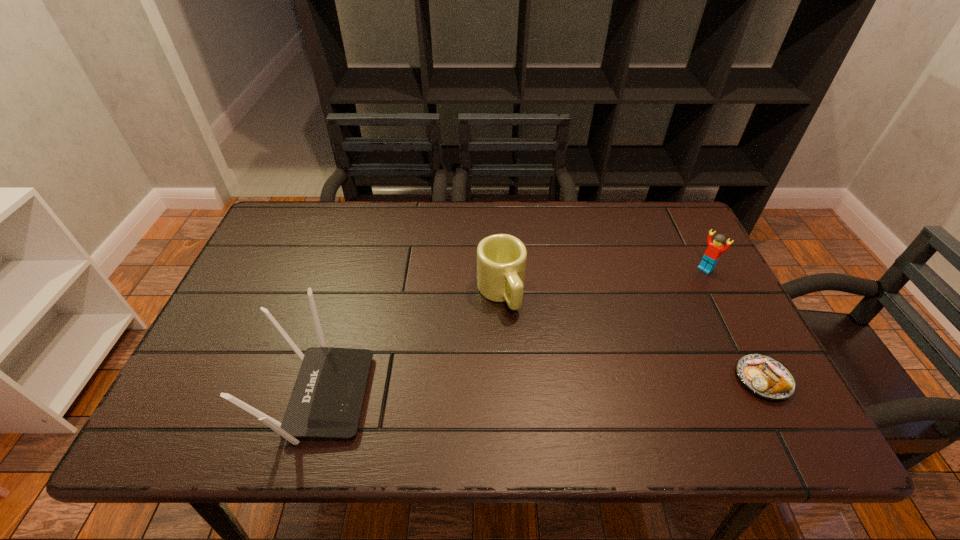
You are a GUI agent. You are given a task and a screenshot of the screen. Output one action in this format:
    pyautogui.click(x=<x>, y=<y>)
    Task: Click on the free space on the desktop that is between the tallest object and the shortest object and is positioned on the face of the Lego
    This screenshot has width=960, height=540.
    Given the screenshot: What is the action you would take?
    pyautogui.click(x=564, y=386)

I want to click on free spot on the desktop that is between the router and the pastry and is positioned with the handle on the side of the mug, so click(549, 387).